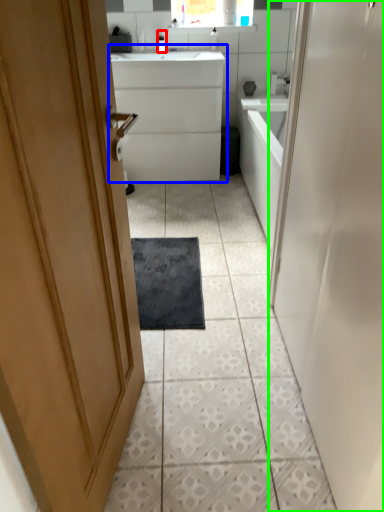
Question: Considering the real-world distances, which object is closest to toiletry (highlighted by a red box)? bathroom cabinet (highlighted by a blue box) or door (highlighted by a green box).

Choices:
 (A) bathroom cabinet
 (B) door

Answer: (A)